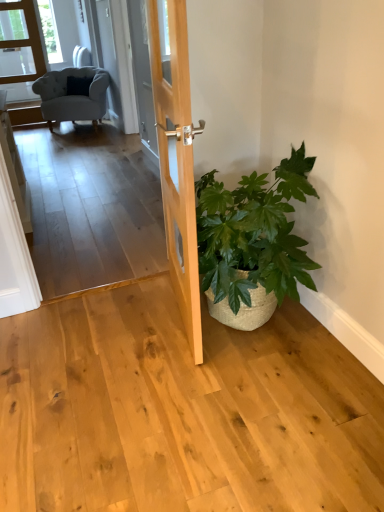
Where is `free space to the left of light brown wood door at center`? This screenshot has width=384, height=512. free space to the left of light brown wood door at center is located at coordinates (101, 329).